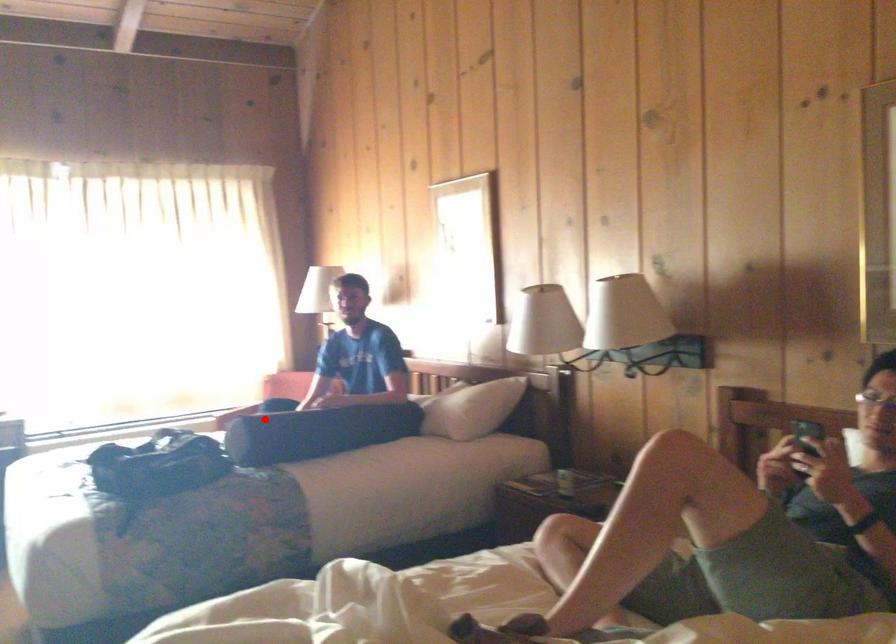
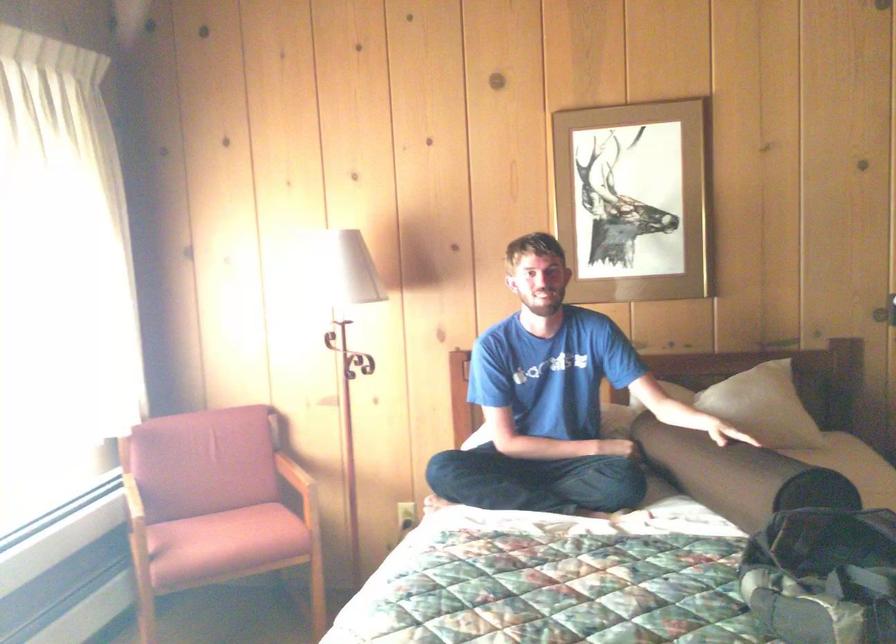
Find the pixel in the second image that matches the highlighted location in the first image.

(737, 475)